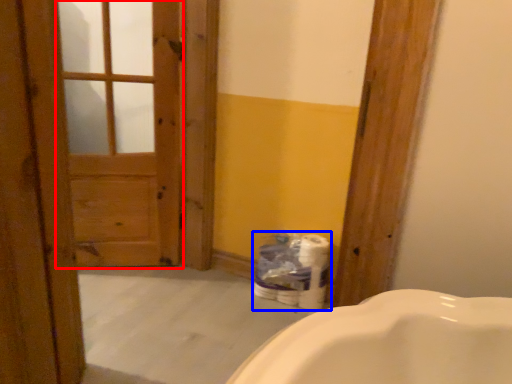
Question: Which point is further to the camera, screen door (highlighted by a red box) or toilet paper (highlighted by a blue box)?

Choices:
 (A) screen door
 (B) toilet paper

Answer: (B)